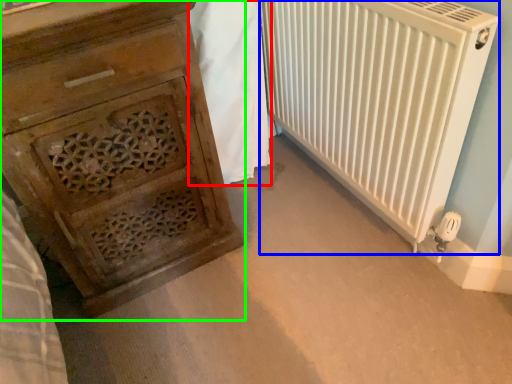
Question: Which object is the farthest from blanket (highlighted by a red box)? Choose among these: radiator (highlighted by a blue box) or chest of drawers (highlighted by a green box).

Choices:
 (A) radiator
 (B) chest of drawers

Answer: (B)